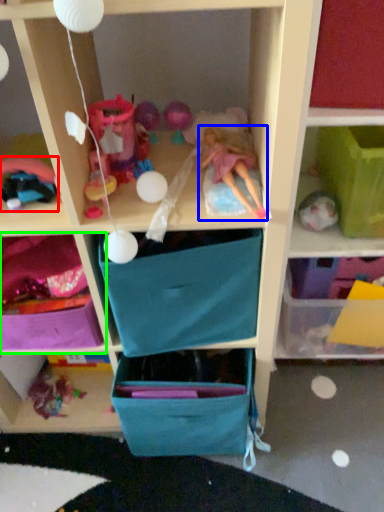
Question: Based on their relative distances, which object is nearer to toy (highlighted by a red box)? Choose from doll (highlighted by a blue box) and shelf (highlighted by a green box).

Choices:
 (A) doll
 (B) shelf

Answer: (B)